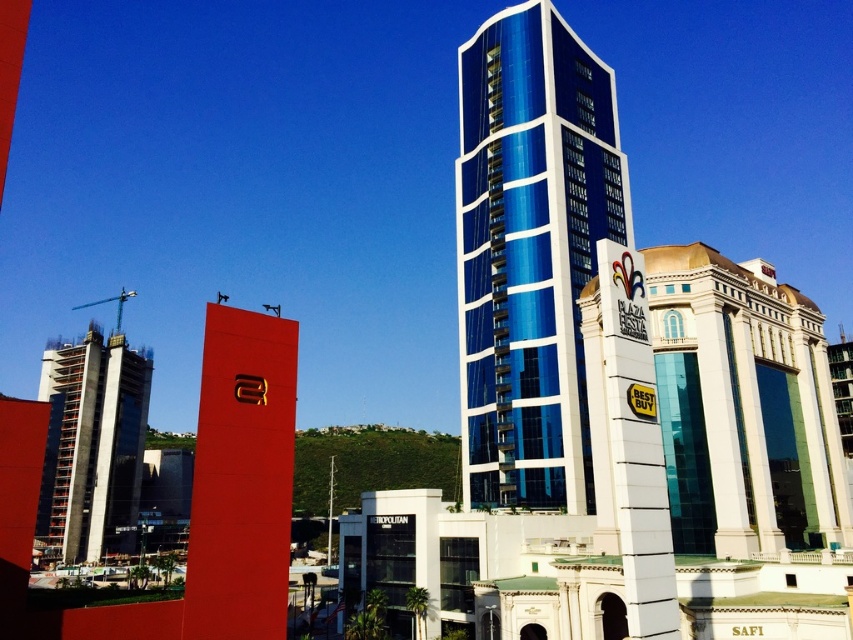
In the scene shown: You are standing in the urban landscape scene and want to determine which of the two points, point [563,397] or point [148,387], is closer to you. Based on the scene description, which point is nearer?

Point [563,397] is closer to the camera than point [148,387], so it is the nearer point.